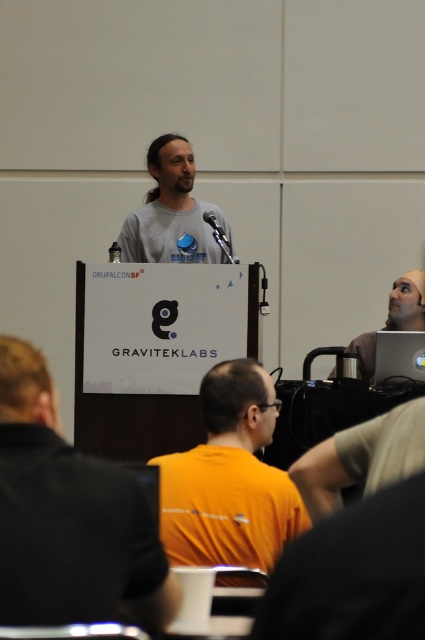
You are a photographer at the event and need to capture a group photo of the black matte shirt at left and gray matte shirt at center. The camera you are using has a maximum focus range of 3 meters. Will you be able to get both subjects in focus at the same time?

The black matte shirt at left and gray matte shirt at center are 3.24 meters apart from each other. Since the camera can only focus up to 3 meters, the distance between them exceeds the focus range. Therefore, you won

Looking at this image, you are organizing a charity event and need to decide which of the two shirts, the black matte shirt at left or the gray matte shirt at center, can fit into a standard hanger without bending. Given that the standard hanger has a width of 12 inches, which shirt should you choose?

The black matte shirt at left is thinner than the gray matte shirt at center, so the black matte shirt at left can fit into the standard hanger without bending.

You are attending a conference and see two people wearing black matte shirt at left and gray matte shirt at center. Which person is standing closer to the front of the stage?

The black matte shirt at left is located below the gray matte shirt at center, meaning it is closer to the front of the stage.